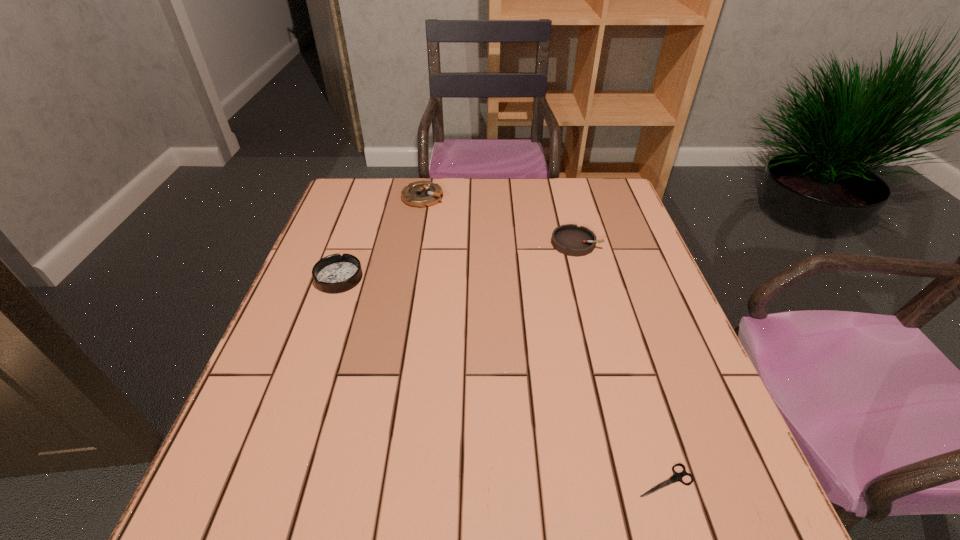
Locate an element on the screen. The image size is (960, 540). free location at the right edge of the desktop is located at coordinates (682, 350).

The width and height of the screenshot is (960, 540). I want to click on free space at the far left corner of the desktop, so click(368, 187).

Locate an element on the screen. The width and height of the screenshot is (960, 540). free region at the near left corner is located at coordinates (198, 537).

The height and width of the screenshot is (540, 960). I want to click on free region at the far right corner of the desktop, so click(x=591, y=202).

Image resolution: width=960 pixels, height=540 pixels. Find the location of `vacant area that lies between the shears and the nearest ashtray`. vacant area that lies between the shears and the nearest ashtray is located at coordinates (502, 379).

Find the location of a particular element. The image size is (960, 540). blank region between the third nearest object and the nearest object is located at coordinates (620, 361).

Find the location of a particular element. free space between the shortest object and the second nearest ashtray is located at coordinates (620, 361).

Where is `free space between the nearest ashtray and the rightmost ashtray`? Image resolution: width=960 pixels, height=540 pixels. free space between the nearest ashtray and the rightmost ashtray is located at coordinates (457, 260).

This screenshot has width=960, height=540. In order to click on vacant area between the rightmost ashtray and the shears in this screenshot , I will do `click(620, 361)`.

Where is `free spot between the shortest object and the farthest object`? This screenshot has width=960, height=540. free spot between the shortest object and the farthest object is located at coordinates (544, 339).